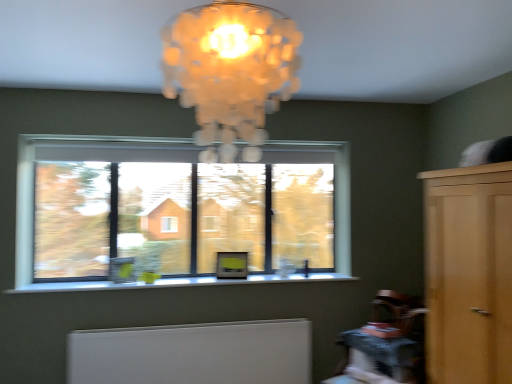
Question: Is light brown wood dresser at right a part of translucent glass chandelier at upper center?

Choices:
 (A) no
 (B) yes

Answer: (A)

Question: Considering the relative positions of translucent glass chandelier at upper center and light brown wood dresser at right in the image provided, is translucent glass chandelier at upper center behind light brown wood dresser at right?

Choices:
 (A) yes
 (B) no

Answer: (B)

Question: Could you tell me if translucent glass chandelier at upper center is facing light brown wood dresser at right?

Choices:
 (A) no
 (B) yes

Answer: (A)

Question: From the image's perspective, is translucent glass chandelier at upper center on light brown wood dresser at right?

Choices:
 (A) no
 (B) yes

Answer: (B)

Question: Is translucent glass chandelier at upper center in front of light brown wood dresser at right?

Choices:
 (A) yes
 (B) no

Answer: (A)

Question: Relative to light brown wood dresser at right, is translucent glass chandelier at upper center in front or behind?

Choices:
 (A) behind
 (B) front

Answer: (B)

Question: Is translucent glass chandelier at upper center spatially inside light brown wood dresser at right, or outside of it?

Choices:
 (A) inside
 (B) outside

Answer: (B)

Question: From the image's perspective, is translucent glass chandelier at upper center located above or below light brown wood dresser at right?

Choices:
 (A) below
 (B) above

Answer: (B)

Question: Visually, is translucent glass chandelier at upper center positioned to the left or to the right of light brown wood dresser at right?

Choices:
 (A) left
 (B) right

Answer: (A)

Question: From the image's perspective, is translucent glass chandelier at upper center positioned above or below wooden textured table at lower right?

Choices:
 (A) below
 (B) above

Answer: (B)

Question: Is translucent glass chandelier at upper center inside the boundaries of wooden textured table at lower right, or outside?

Choices:
 (A) outside
 (B) inside

Answer: (A)

Question: Would you say translucent glass chandelier at upper center is to the left or to the right of wooden textured table at lower right in the picture?

Choices:
 (A) right
 (B) left

Answer: (B)

Question: Considering the positions of translucent glass chandelier at upper center and wooden textured table at lower right in the image, is translucent glass chandelier at upper center taller or shorter than wooden textured table at lower right?

Choices:
 (A) short
 (B) tall

Answer: (B)

Question: Looking at their shapes, would you say white matte radiator at lower center is wider or thinner than clear glass window at center?

Choices:
 (A) wide
 (B) thin

Answer: (A)

Question: Does point (259, 331) appear closer or farther from the camera than point (125, 254)?

Choices:
 (A) farther
 (B) closer

Answer: (B)